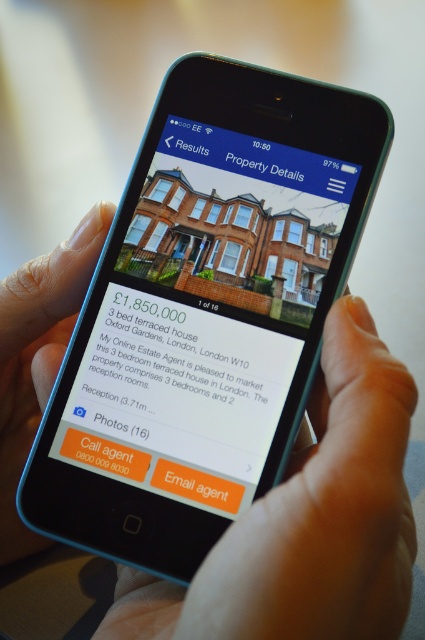
Question: Does smooth skin hand at lower right appear under blue glossy property details at upper center?

Choices:
 (A) no
 (B) yes

Answer: (B)

Question: Which object is closer to the camera taking this photo?

Choices:
 (A) blue glossy property details at upper center
 (B) nail polish at lower left

Answer: (B)

Question: Which point is farther to the camera?

Choices:
 (A) blue glossy property details at upper center
 (B) nail polish at lower left

Answer: (A)

Question: Is smooth skin hand at lower right thinner than nail polish at lower left?

Choices:
 (A) no
 (B) yes

Answer: (A)

Question: Among these points, which one is farthest from the camera?

Choices:
 (A) (303, 150)
 (B) (198, 605)

Answer: (A)

Question: Does smooth skin hand at lower right have a larger size compared to nail polish at lower left?

Choices:
 (A) no
 (B) yes

Answer: (B)